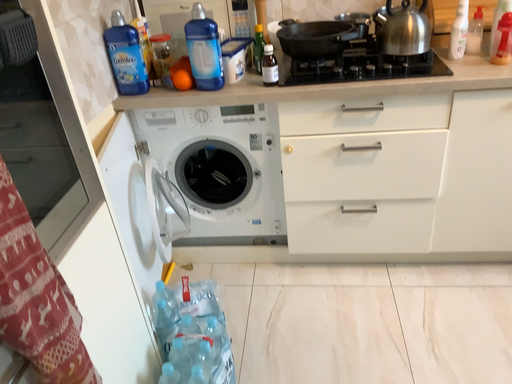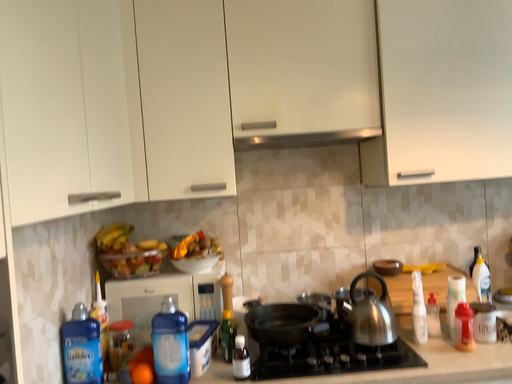
Question: How did the camera likely rotate when shooting the video?

Choices:
 (A) rotated right
 (B) rotated left

Answer: (A)